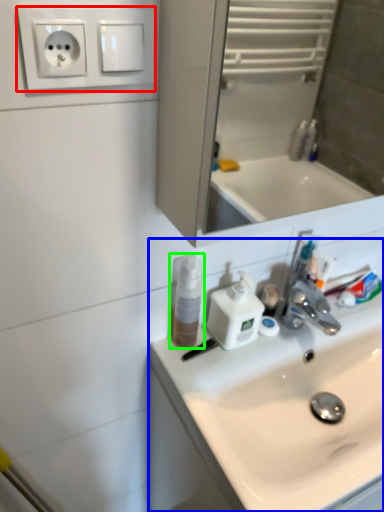
Question: Which is nearer to the electric outlet (highlighted by a red box)? sink (highlighted by a blue box) or mouthwash (highlighted by a green box).

Choices:
 (A) sink
 (B) mouthwash

Answer: (B)